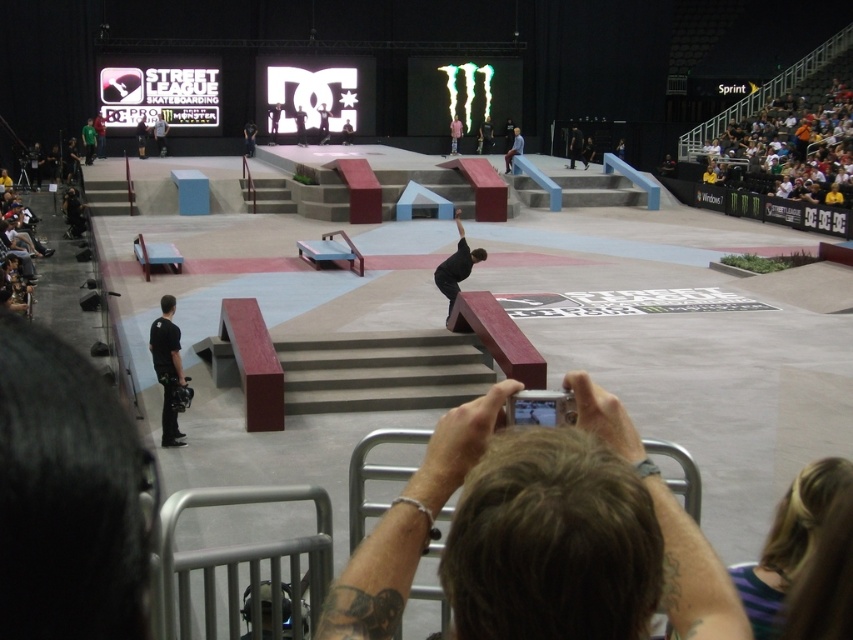
Question: Estimate the real-world distances between objects in this image. Which object is farther from the dark brown hair at lower center?

Choices:
 (A) light blue shirt at upper right
 (B) black matte skateboarder at center
 (C) black matte camera at center

Answer: (A)

Question: Which point is farther to the camera?

Choices:
 (A) (468, 576)
 (B) (508, 150)

Answer: (B)

Question: Does dark brown hair at lower center come behind orange fabric crowd at upper right?

Choices:
 (A) no
 (B) yes

Answer: (A)

Question: Estimate the real-world distances between objects in this image. Which object is farther from the black matte camera at center?

Choices:
 (A) dark brown hair at lower center
 (B) orange fabric crowd at upper right
 (C) light blue shirt at upper right
 (D) black matte skateboarder at center

Answer: (B)

Question: Does dark brown hair at lower center have a lesser width compared to orange fabric crowd at upper right?

Choices:
 (A) yes
 (B) no

Answer: (A)

Question: Does black matte camera at center appear over black matte skateboarder at center?

Choices:
 (A) yes
 (B) no

Answer: (B)